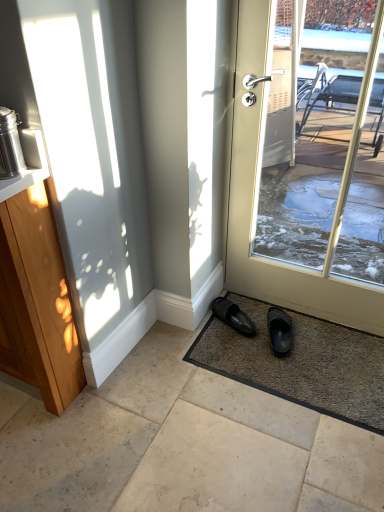
This screenshot has width=384, height=512. I want to click on free space above smooth beige tiles at center (from a real-world perspective), so click(204, 402).